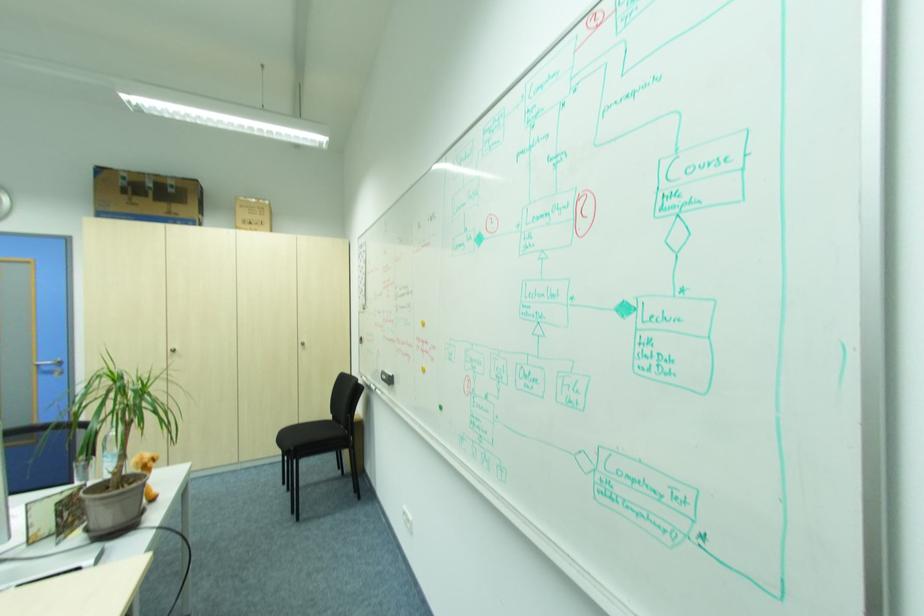
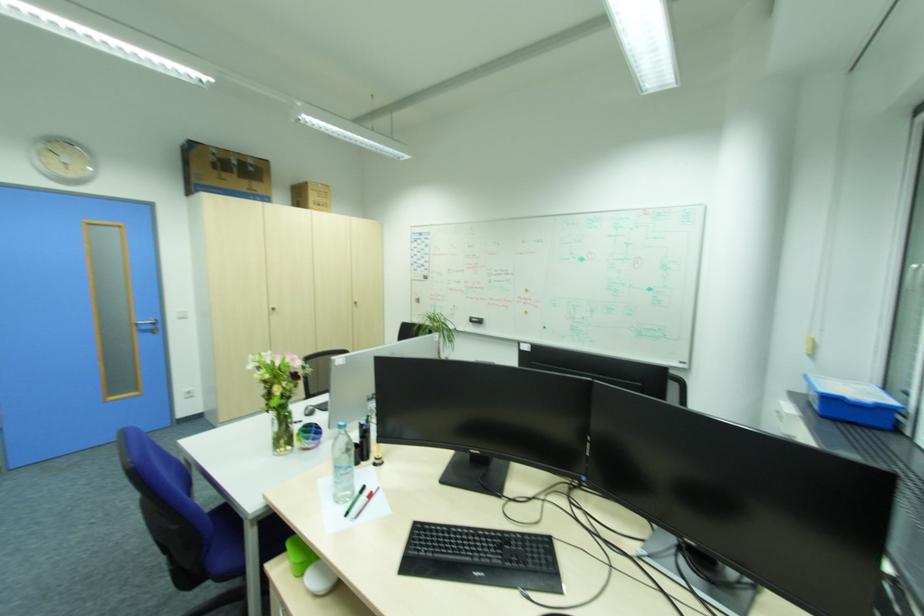
The images are taken continuously from a first-person perspective. In which direction are you moving?

The cameraman walked toward left, backward.